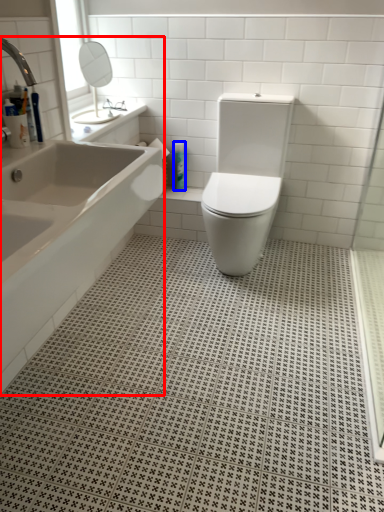
Question: Which object is further to the camera taking this photo, bathtub (highlighted by a red box) or toiletry (highlighted by a blue box)?

Choices:
 (A) bathtub
 (B) toiletry

Answer: (B)